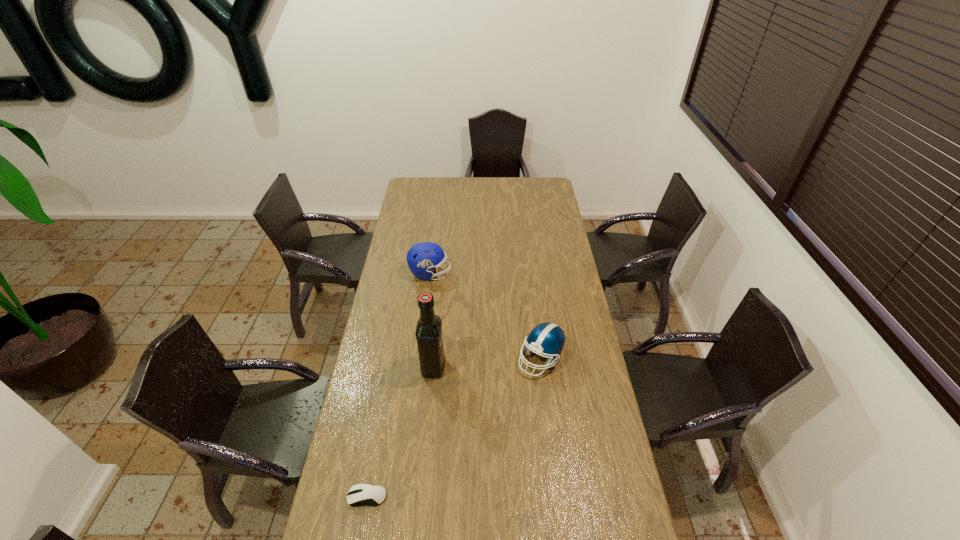
Find the location of a particular element. liquor is located at coordinates (428, 332).

This screenshot has height=540, width=960. Find the location of `the farther football helmet`. the farther football helmet is located at coordinates (423, 257).

You are a GUI agent. You are given a task and a screenshot of the screen. Output one action in this format:
    pyautogui.click(x=<x>, y=<y>)
    Task: Click on the farthest object
    This screenshot has width=960, height=540.
    Given the screenshot: What is the action you would take?
    pyautogui.click(x=423, y=257)

Locate an element on the screen. Image resolution: width=960 pixels, height=540 pixels. the right football helmet is located at coordinates click(548, 339).

Find the location of a particular element. the nearer football helmet is located at coordinates (548, 339).

You are a GUI agent. You are given a task and a screenshot of the screen. Output one action in this format:
    pyautogui.click(x=<x>, y=<y>)
    Task: Click on the mouse
    The image size is (960, 540).
    Given the screenshot: What is the action you would take?
    pyautogui.click(x=359, y=494)

Identify the location of the nearest object. The width and height of the screenshot is (960, 540). (359, 494).

Find the location of a particular element. free space located on the front-facing side of the liquor is located at coordinates (478, 367).

Where is `free space located 0.290m on the front-facing side of the farther football helmet`? Image resolution: width=960 pixels, height=540 pixels. free space located 0.290m on the front-facing side of the farther football helmet is located at coordinates (511, 274).

In order to click on free space located 0.100m at the front of the rightmost object with the faceguard in this screenshot , I will do `click(546, 403)`.